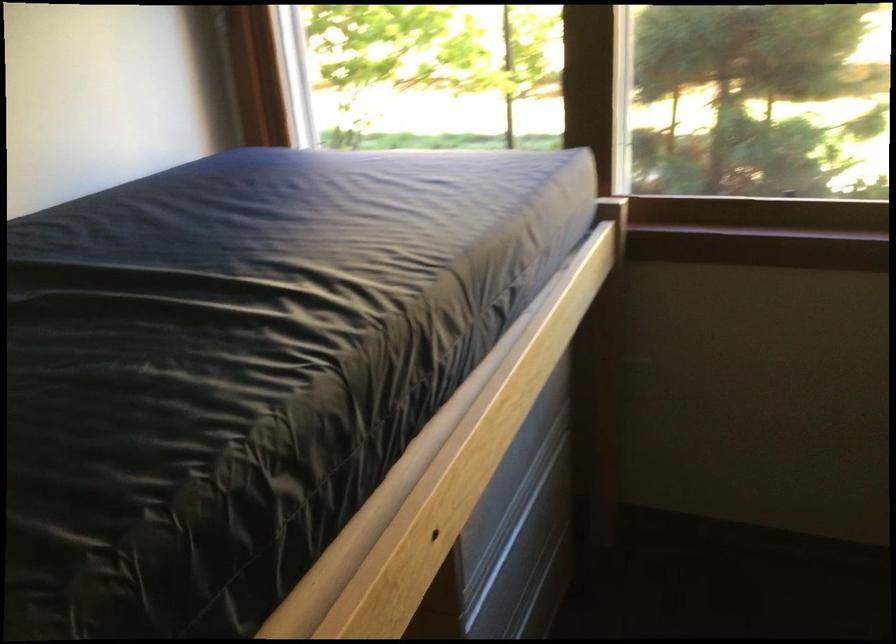
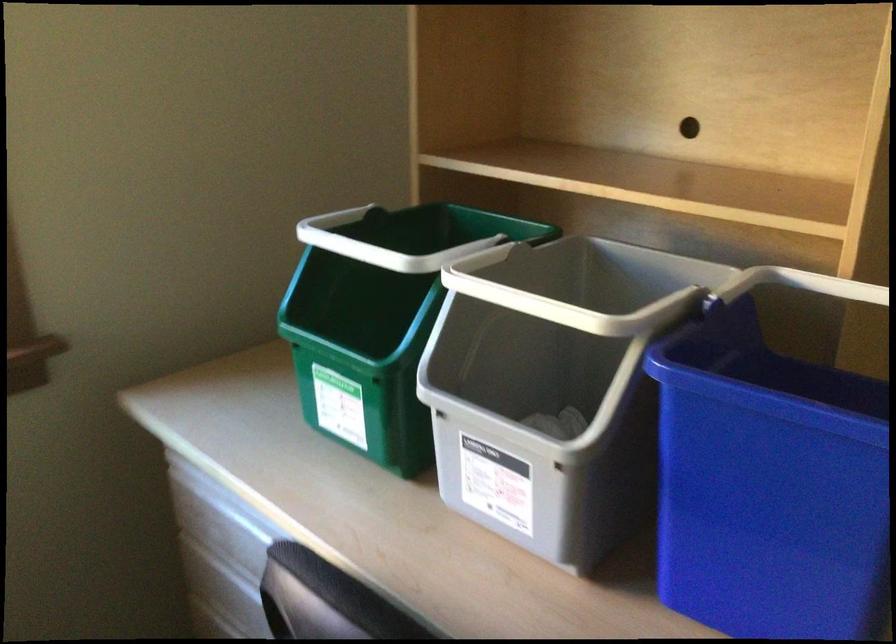
Question: Based on the continuous images, in which direction is the camera rotating? Reply with the corresponding letter.

Choices:
 (A) Left
 (B) Right
 (C) Up
 (D) Down

Answer: (B)